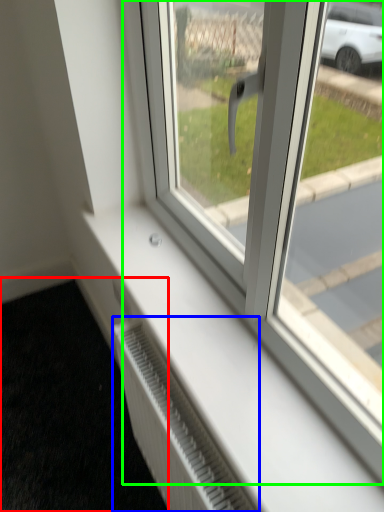
Question: Which object is positioned closest to pavement (highlighted by a red box)? Select from radiator (highlighted by a blue box) and window (highlighted by a green box).

Choices:
 (A) radiator
 (B) window

Answer: (A)